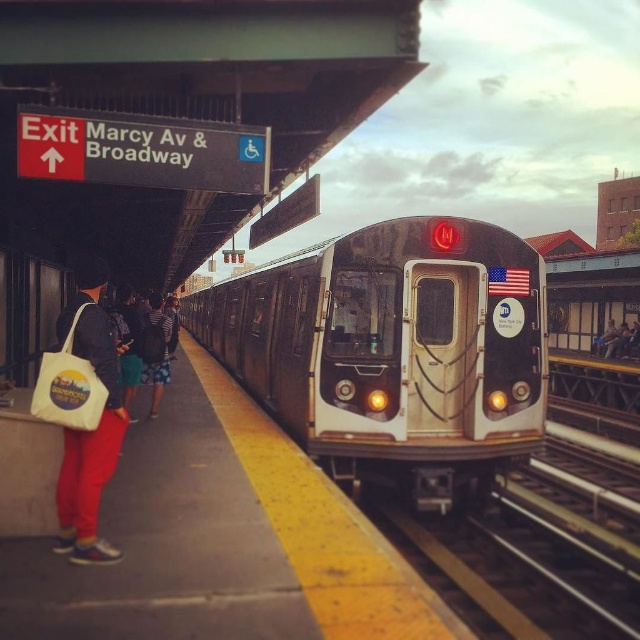
Measure the distance between point (288, 396) and camera.

Point (288, 396) is 9.57 meters away from camera.

Does silver metallic train at center have a greater width compared to matte white tote bag at lower left?

Indeed, silver metallic train at center has a greater width compared to matte white tote bag at lower left.

Measure the distance between silver metallic train at center and camera.

silver metallic train at center is 7.45 meters away from camera.

Find the location of `silver metallic train at center`. silver metallic train at center is located at coordinates (394, 349).

How far apart are matte white tote bag at lower left and striped shirt at center?

19.31 feet

In the scene shown: Does matte white tote bag at lower left appear over striped shirt at center?

No.

Between point (100, 272) and point (145, 362), which one is positioned in front?

Point (100, 272) is in front.

Identify the location of matte white tote bag at lower left. The width and height of the screenshot is (640, 640). (92, 429).

In the scene shown: Is silver metallic train at center to the left of striped shirt at center from the viewer's perspective?

In fact, silver metallic train at center is to the right of striped shirt at center.

Is point (307, 353) positioned in front of point (154, 317)?

Yes, point (307, 353) is in front of point (154, 317).

Locate an element on the screen. Image resolution: width=640 pixels, height=640 pixels. silver metallic train at center is located at coordinates point(394,349).

You are a GUI agent. You are given a task and a screenshot of the screen. Output one action in this format:
    pyautogui.click(x=<x>, y=<y>)
    Task: Click on the silver metallic train at center
    Image resolution: width=640 pixels, height=640 pixels.
    Given the screenshot: What is the action you would take?
    pyautogui.click(x=394, y=349)